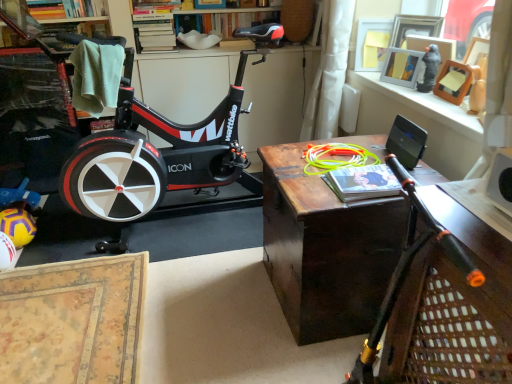
Find the location of a particular element. This screenshot has height=384, width=512. free space above wooden frame at upper right (from a real-world perspective) is located at coordinates (424, 97).